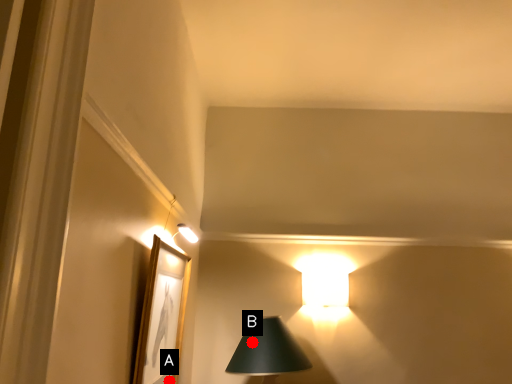
Question: Two points are circled on the image, labeled by A and B beside each circle. Which point is closer to the camera taking this photo?

Choices:
 (A) A is closer
 (B) B is closer

Answer: (A)